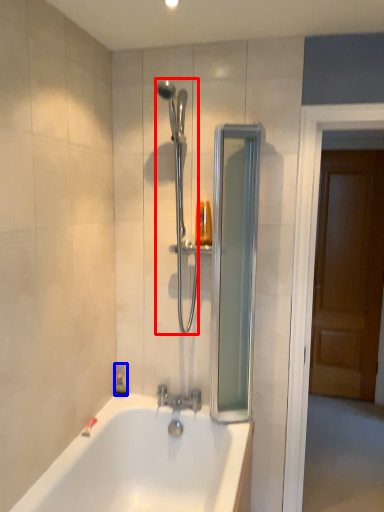
Question: Which of the following is the farthest to the observer, shower (highlighted by a red box) or soap dispenser (highlighted by a blue box)?

Choices:
 (A) shower
 (B) soap dispenser

Answer: (B)